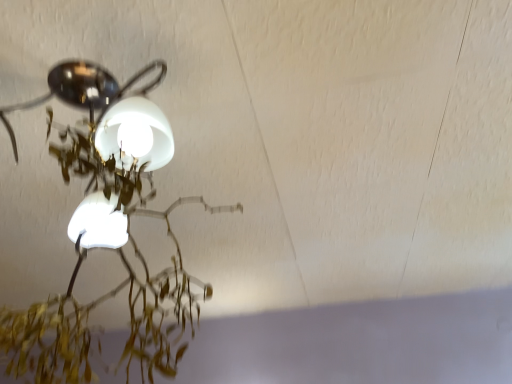
This screenshot has width=512, height=384. What do you see at coordinates (109, 236) in the screenshot? I see `matte white lamp at upper left` at bounding box center [109, 236].

Image resolution: width=512 pixels, height=384 pixels. Identify the location of matte white lamp at upper left. (109, 236).

Identify the location of matte white lamp at upper left. The height and width of the screenshot is (384, 512). (109, 236).